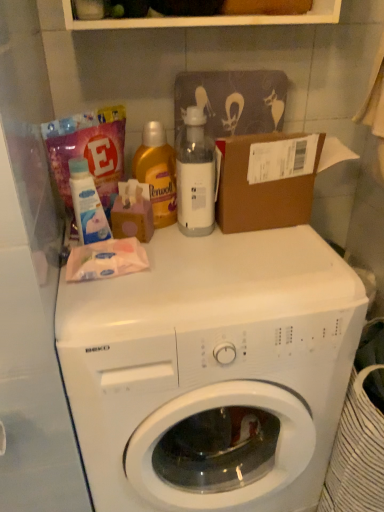
Locate an element on the screen. This screenshot has height=512, width=384. vacant region in front of pink polka dot tissue box at upper center is located at coordinates (142, 284).